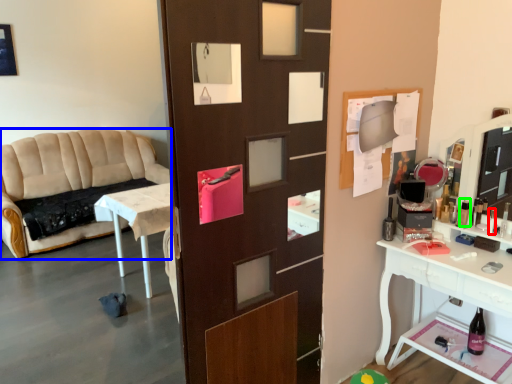
Question: Which is farther away from toiletry (highlighted by a red box)? studio couch (highlighted by a blue box) or toiletry (highlighted by a green box)?

Choices:
 (A) studio couch
 (B) toiletry

Answer: (A)